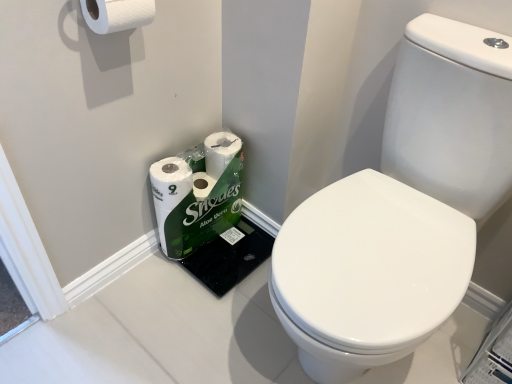
Find the location of a particular element. vacant space that is to the left of white glossy toilet at center is located at coordinates (183, 322).